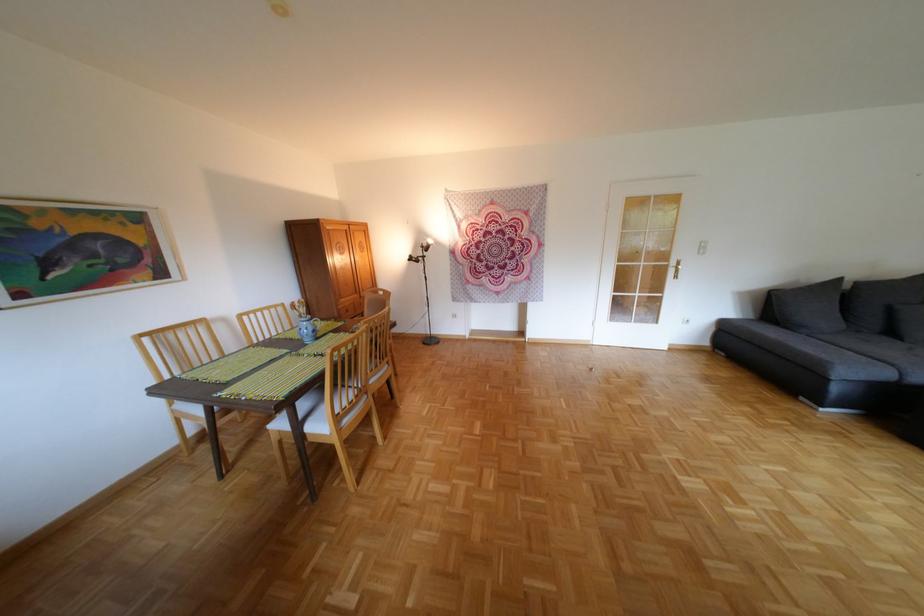
Describe the element at coordinates (675, 269) in the screenshot. This screenshot has height=616, width=924. I see `the gold door handle` at that location.